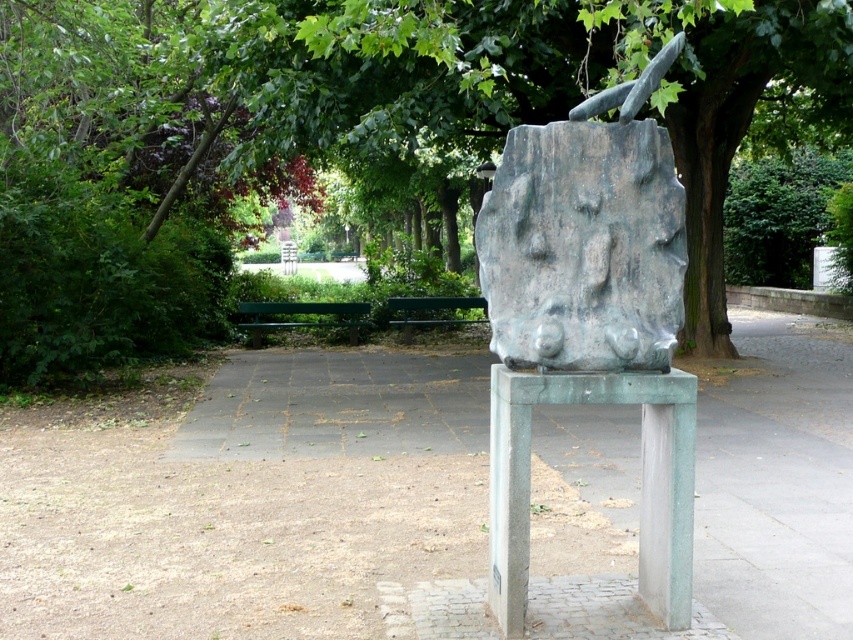
Is point (397, 138) positioned after point (260, 321)?

No, it is in front of (260, 321).

Which of these two, green leafy tree at center or green painted wood bench at center, stands taller?

With more height is green leafy tree at center.

Which is behind, point (708, 237) or point (349, 304)?

Positioned behind is point (349, 304).

Locate an element on the screen. The height and width of the screenshot is (640, 853). green leafy tree at center is located at coordinates (399, 93).

Between gray stone sculpture at center and green patinated stone stool at center, which one appears on the right side from the viewer's perspective?

From the viewer's perspective, green patinated stone stool at center appears more on the right side.

How much distance is there between gray stone sculpture at center and green patinated stone stool at center?

gray stone sculpture at center is 6.85 inches from green patinated stone stool at center.

Which is behind, point (628, 204) or point (646, 532)?

Positioned behind is point (646, 532).

This screenshot has height=640, width=853. I want to click on gray stone sculpture at center, so click(589, 323).

Where is `green painted wood bench at center`? This screenshot has width=853, height=640. green painted wood bench at center is located at coordinates (303, 314).

Who is more distant from viewer, [287,324] or [412,307]?

Positioned behind is point [412,307].

Locate an element on the screen. The image size is (853, 640). green painted wood bench at center is located at coordinates (303, 314).